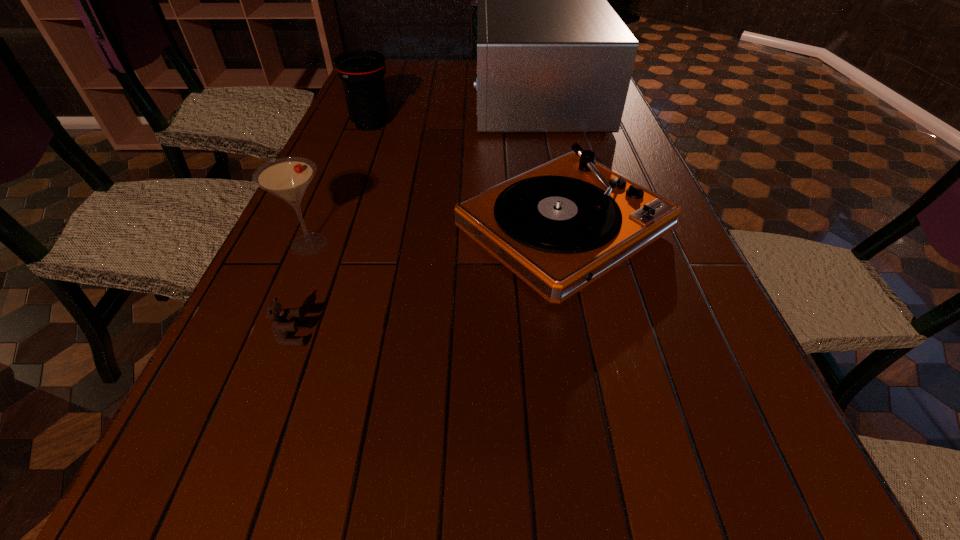
This screenshot has height=540, width=960. In order to click on vacant space located 0.230m on the front of the martini in this screenshot , I will do `click(265, 353)`.

Find the location of a particular element. The image size is (960, 540). free space located 0.310m on the back of the second shortest object is located at coordinates (540, 120).

Locate an element on the screen. This screenshot has width=960, height=540. vacant space located 0.180m on the face of the shortest object is located at coordinates (409, 336).

At what (x,y) coordinates should I click in order to perform the action: click on object present at the far edge. Please return your answer as a coordinate pair (x, y). The height and width of the screenshot is (540, 960). Looking at the image, I should click on (553, 56).

Image resolution: width=960 pixels, height=540 pixels. I want to click on telephoto lens at the left edge, so click(362, 72).

The height and width of the screenshot is (540, 960). Find the location of `martini that is at the left edge`. martini that is at the left edge is located at coordinates (288, 178).

Identify the location of teddy bear that is at the left edge. This screenshot has height=540, width=960. (281, 327).

Image resolution: width=960 pixels, height=540 pixels. I want to click on microwave oven positioned at the right edge, so [x=553, y=56].

This screenshot has height=540, width=960. What are the coordinates of `record player that is positioned at the right edge` in the screenshot? It's located at (560, 226).

Find the location of `object that is at the far right corner`. object that is at the far right corner is located at coordinates (553, 56).